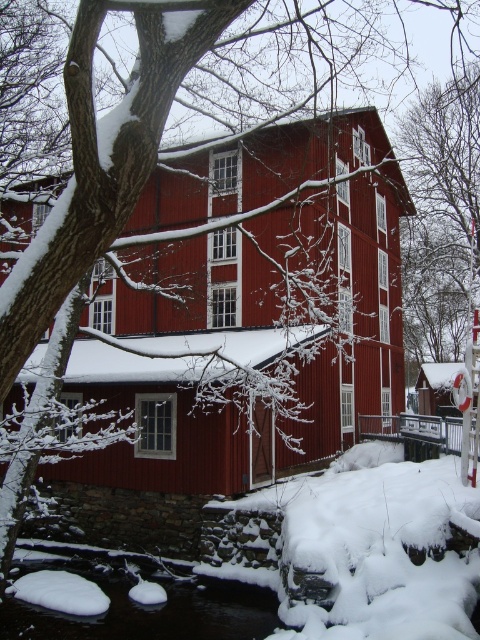
Is matte red barn at center to the left of black ice at lower center from the viewer's perspective?

Incorrect, matte red barn at center is not on the left side of black ice at lower center.

Locate an element on the screen. The width and height of the screenshot is (480, 640). matte red barn at center is located at coordinates (313, 250).

The image size is (480, 640). What are the coordinates of `matte red barn at center` in the screenshot? It's located at (313, 250).